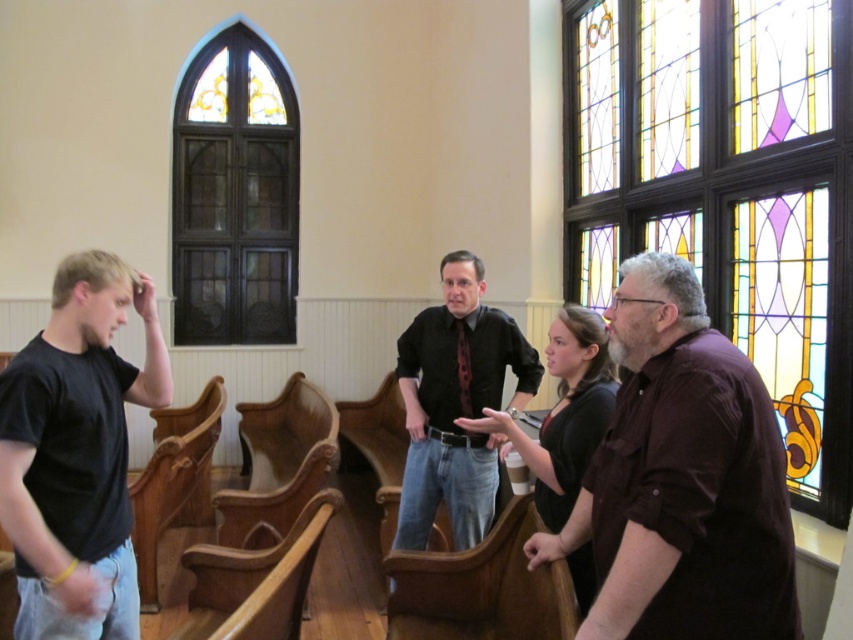
Question: Where is stained glass window at right located in relation to stained glass window at upper left in the image?

Choices:
 (A) right
 (B) left

Answer: (A)

Question: Estimate the real-world distances between objects in this image. Which object is closer to the brown satin shirt at right?

Choices:
 (A) matte black shirt at center
 (B) stained glass window at upper left
 (C) black matte t-shirt at left

Answer: (A)

Question: Which of the following is the farthest from the observer?

Choices:
 (A) stained glass window at right
 (B) brown satin shirt at right
 (C) black matte t-shirt at left
 (D) stained glass window at upper left

Answer: (D)

Question: Among these objects, which one is farthest from the camera?

Choices:
 (A) stained glass window at right
 (B) black matte t-shirt at left
 (C) stained glass window at upper left
 (D) brown satin shirt at right

Answer: (C)

Question: Where is brown satin shirt at right located in relation to black matte t-shirt at left in the image?

Choices:
 (A) above
 (B) below

Answer: (A)

Question: Considering the relative positions of brown satin shirt at right and stained glass window at upper left in the image provided, where is brown satin shirt at right located with respect to stained glass window at upper left?

Choices:
 (A) above
 (B) below

Answer: (B)